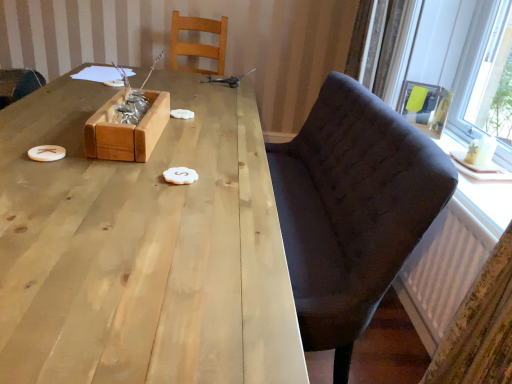
Where is `vacant space to the right of white matte cookie at center, marked as the second food in a right-to-left arrangement`? vacant space to the right of white matte cookie at center, marked as the second food in a right-to-left arrangement is located at coordinates (218, 123).